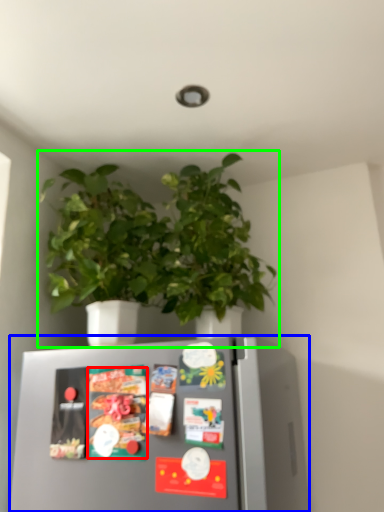
Question: Considering the real-world distances, which object is closest to food (highlighted by a red box)? refrigerator (highlighted by a blue box) or houseplant (highlighted by a green box).

Choices:
 (A) refrigerator
 (B) houseplant

Answer: (A)